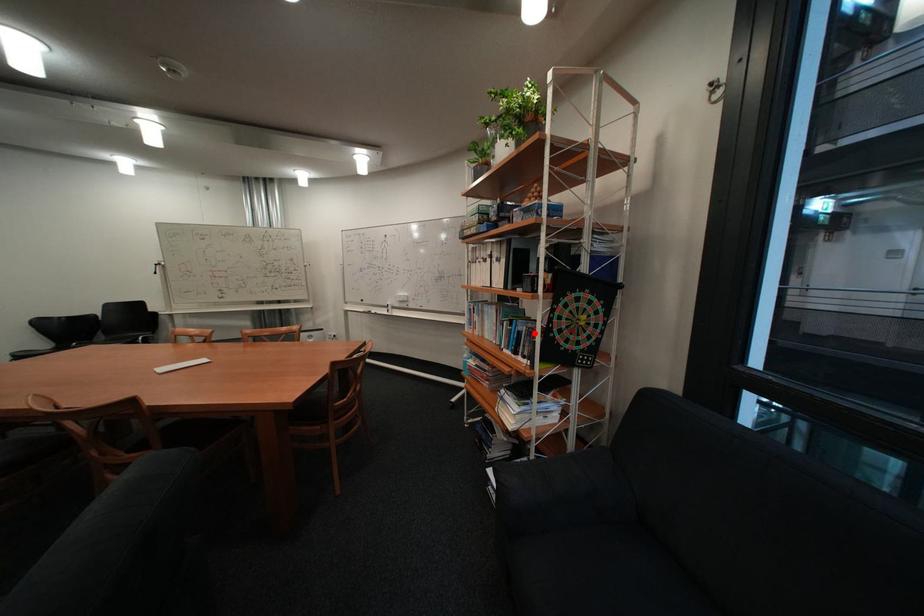
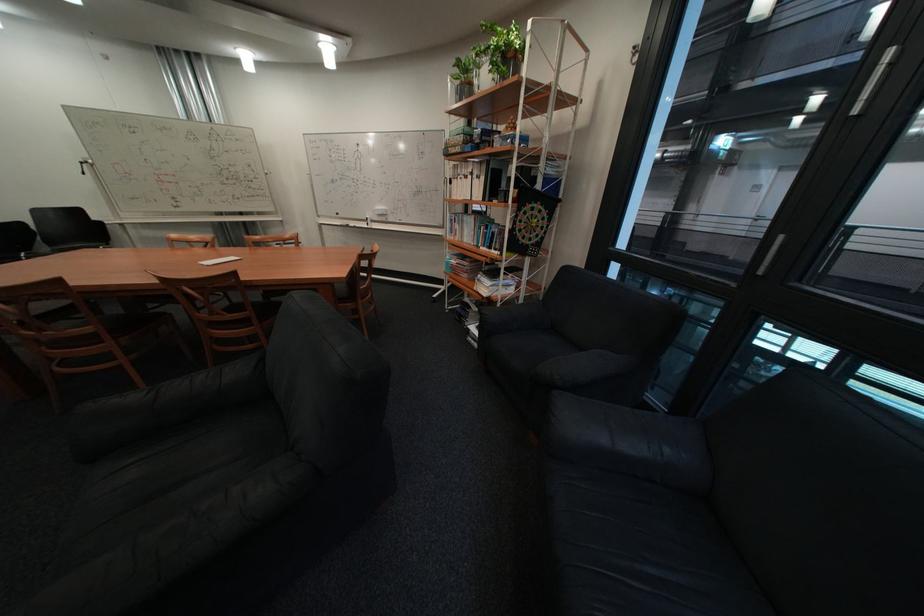
Question: I am providing you with two images of the same scene from different viewpoints. Image1 has a red point marked. In image2, the corresponding 3D location appears at what relative position? Reply with the corresponding letter.

Choices:
 (A) Closer
 (B) Farther

Answer: (A)